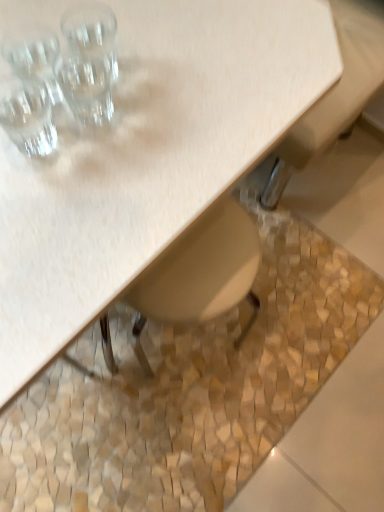
Find the location of `vacant area that is situated to the right of transparent glass at upper left, the third shot glass ordered from the bottom`. vacant area that is situated to the right of transparent glass at upper left, the third shot glass ordered from the bottom is located at coordinates (198, 79).